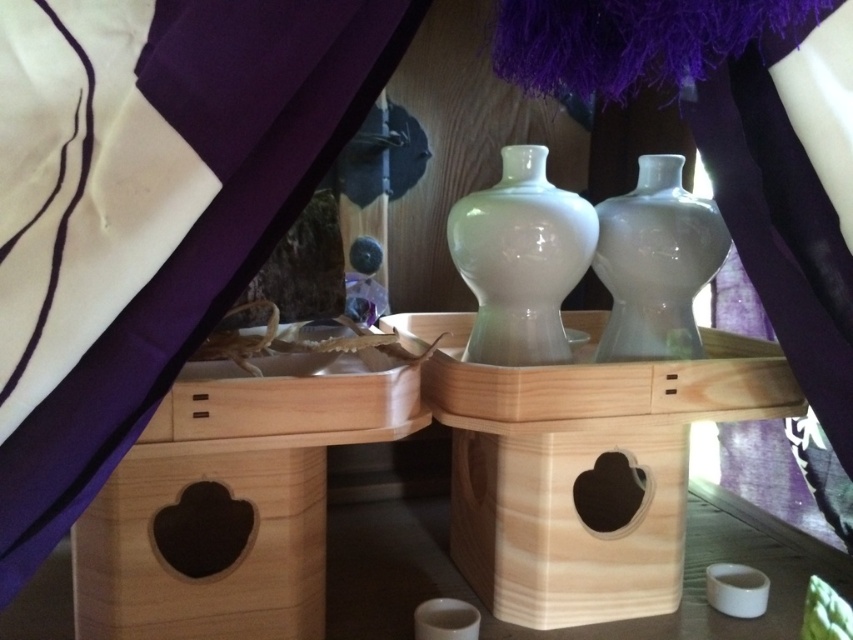
From the picture: Does natural wood table at center appear under white glossy vase at center?

Yes, natural wood table at center is below white glossy vase at center.

Who is higher up, natural wood table at center or white glossy vase at center?

white glossy vase at center

At what (x,y) coordinates should I click in order to perform the action: click on natural wood table at center. Please return your answer as a coordinate pair (x, y). Image resolution: width=853 pixels, height=640 pixels. Looking at the image, I should click on (451, 483).

Where is `natural wood table at center`? This screenshot has width=853, height=640. natural wood table at center is located at coordinates (451, 483).

Who is lower down, white glossy vase at center or transparent glass vase at center?

Positioned lower is white glossy vase at center.

Who is more distant from viewer, (555, 221) or (660, 188)?

Positioned behind is point (660, 188).

You are a GUI agent. You are given a task and a screenshot of the screen. Output one action in this format:
    pyautogui.click(x=<x>, y=<y>)
    Task: Click on the white glossy vase at center
    The image size is (853, 640).
    Given the screenshot: What is the action you would take?
    pyautogui.click(x=520, y=259)

From the picture: Does purple fabric curtain at upper left have a smaller size compared to natural wood table at center?

Yes, purple fabric curtain at upper left is smaller than natural wood table at center.

From the picture: Is purple fabric curtain at upper left to the right of natural wood table at center from the viewer's perspective?

Incorrect, purple fabric curtain at upper left is not on the right side of natural wood table at center.

Is point (91, 301) closer to viewer compared to point (137, 604)?

That is True.

Locate an element on the screen. purple fabric curtain at upper left is located at coordinates (148, 208).